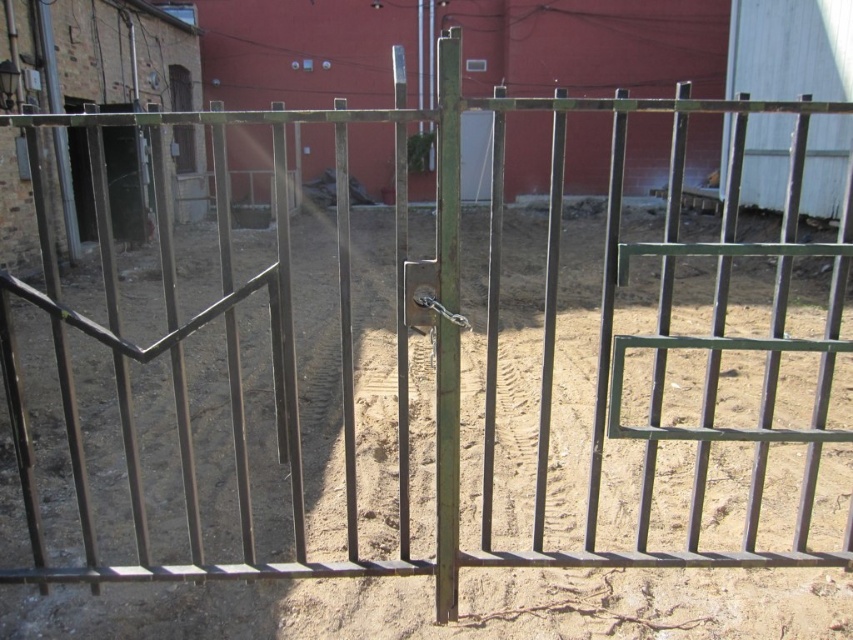
You are a delivery person trying to enter through the wooden door at upper left. The metallic gate at left is partially open. Can you walk through the gate to reach the door?

The metallic gate at left has a greater height compared to wooden door at upper left, so yes, you can walk through the gate to reach the wooden door at upper left since the gate is tall enough.

You are a delivery person trying to enter through the gate. You see the metallic silver door at center and the wooden door at upper left. Which door is taller?

The wooden door at upper left is taller than the metallic silver door at center.